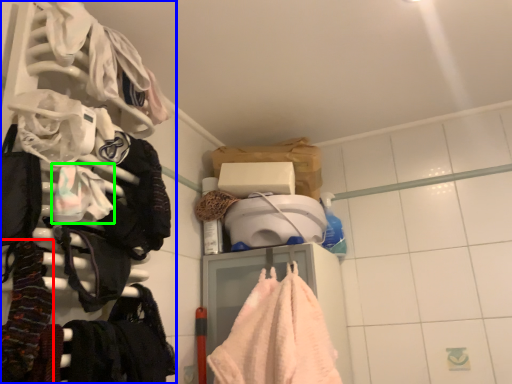
Question: Estimate the real-world distances between objects in this image. Which object is closer to clothing (highlighted by a red box), closet (highlighted by a blue box) or clothing (highlighted by a green box)?

Choices:
 (A) closet
 (B) clothing

Answer: (B)